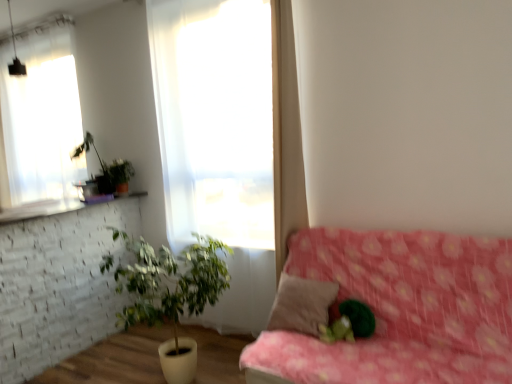
Find the location of a particular element. The image size is (512, 384). free space below green leafy plant in white pot at lower left, placed as the second houseplant when sorted from back to front (from a real-world perspective) is located at coordinates (160, 369).